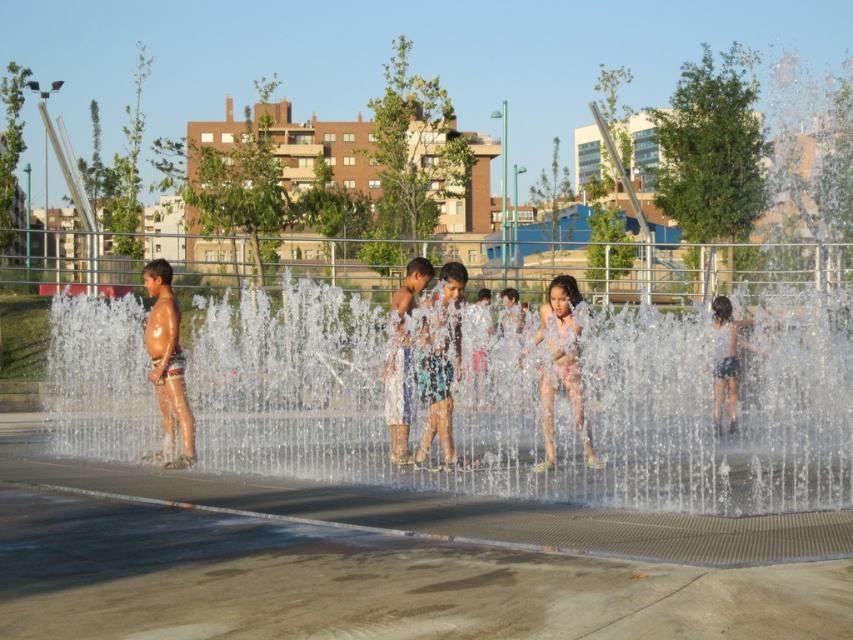
Question: Is white cotton shorts at center to the left of dark blue shorts at right from the viewer's perspective?

Choices:
 (A) no
 (B) yes

Answer: (B)

Question: Among these points, which one is farthest from the camera?

Choices:
 (A) (410, 403)
 (B) (120, 412)

Answer: (B)

Question: In this image, where is blue denim shorts at center located relative to dark blue shorts at right?

Choices:
 (A) below
 (B) above

Answer: (B)

Question: Which point appears closest to the camera in this image?

Choices:
 (A) (163, 451)
 (B) (440, 276)
 (C) (358, 365)
 (D) (585, 445)

Answer: (B)

Question: Which object is farther from the camera taking this photo?

Choices:
 (A) pink fabric dress at center
 (B) white cotton shorts at center

Answer: (B)

Question: Does blue denim shorts at center appear on the right side of white cotton shorts at center?

Choices:
 (A) yes
 (B) no

Answer: (A)